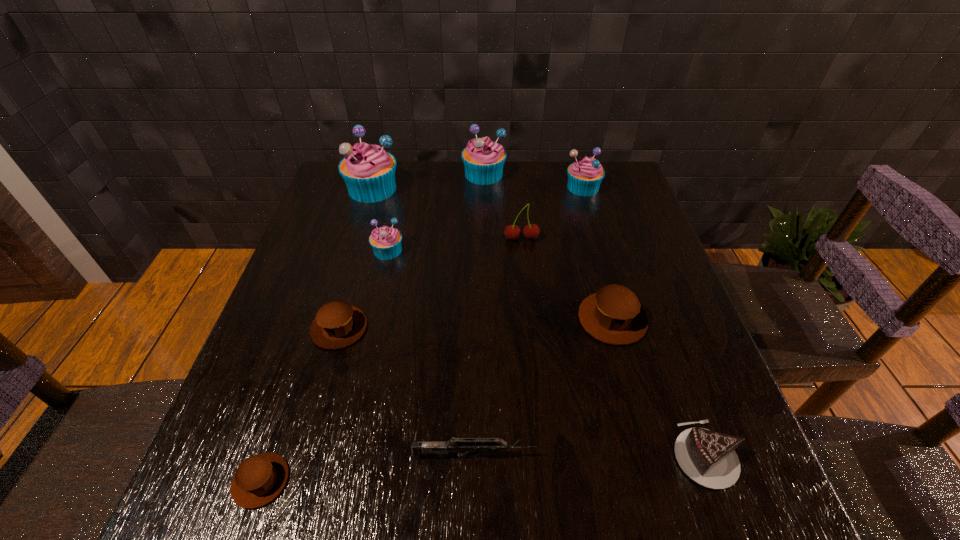
The height and width of the screenshot is (540, 960). In order to click on the second shortest muffin in this screenshot , I will do `click(337, 324)`.

Image resolution: width=960 pixels, height=540 pixels. In order to click on gun in this screenshot , I will do `click(464, 445)`.

The width and height of the screenshot is (960, 540). In order to click on chocolate cake in this screenshot , I will do `click(708, 457)`.

Find the location of a particular element. This screenshot has width=960, height=540. the shortest muffin is located at coordinates (259, 479).

Identify the location of the smallest brown muffin. (259, 479).

The height and width of the screenshot is (540, 960). What are the coordinates of `vacant space situated on the right of the biggest blue muffin` in the screenshot? It's located at (417, 189).

The width and height of the screenshot is (960, 540). Find the location of `blank area located on the right of the sixth shortest muffin`. blank area located on the right of the sixth shortest muffin is located at coordinates (524, 174).

The image size is (960, 540). I want to click on free space located on the front of the rightmost blue muffin, so click(595, 227).

Identify the location of free space located 0.390m on the surface of the cherry. (536, 372).

I want to click on vacant space located 0.260m on the right of the fourth farthest muffin, so (505, 251).